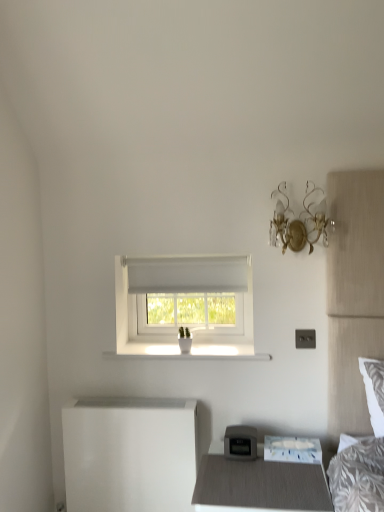
The height and width of the screenshot is (512, 384). Describe the element at coordinates (184, 305) in the screenshot. I see `white fabric window at center` at that location.

What is the approximate width of white fabric window at center?

white fabric window at center is 10.39 inches wide.

What do you see at coordinates (298, 223) in the screenshot? The width and height of the screenshot is (384, 512). I see `gold metallic wall sconce at upper right` at bounding box center [298, 223].

Measure the distance between white glossy changing table at lower left and camera.

6.10 feet.

This screenshot has width=384, height=512. In order to click on white fabric window at center in this screenshot , I will do `click(184, 305)`.

Can you confirm if white glossy changing table at lower left is positioned to the right of matte gray nightstand at lower center?

Incorrect, white glossy changing table at lower left is not on the right side of matte gray nightstand at lower center.

Is point (110, 441) closer to camera compared to point (239, 488)?

No, (110, 441) is behind (239, 488).

How different are the orientations of white glossy changing table at lower left and matte gray nightstand at lower center in degrees?

white glossy changing table at lower left and matte gray nightstand at lower center are facing 3.27 degrees away from each other.

Who is bigger, white glossy changing table at lower left or matte gray nightstand at lower center?

matte gray nightstand at lower center is bigger.

Considering the sizes of objects matte gray nightstand at lower center and white glossy changing table at lower left in the image provided, who is smaller, matte gray nightstand at lower center or white glossy changing table at lower left?

Smaller between the two is white glossy changing table at lower left.

Is matte gray nightstand at lower center shorter than white glossy changing table at lower left?

Yes, matte gray nightstand at lower center is shorter than white glossy changing table at lower left.

How many degrees apart are the facing directions of matte gray nightstand at lower center and white glossy changing table at lower left?

The facing directions of matte gray nightstand at lower center and white glossy changing table at lower left are 3.27 degrees apart.

Is white glossy changing table at lower left at the back of matte gray nightstand at lower center?

No, matte gray nightstand at lower center is not facing away from white glossy changing table at lower left.

Does white glossy changing table at lower left touch gold metallic wall sconce at upper right?

They are not placed beside each other.

Is white glossy changing table at lower left outside of gold metallic wall sconce at upper right?

Yes, white glossy changing table at lower left is outside of gold metallic wall sconce at upper right.

Which is further, (115, 434) or (298, 245)?

The point (115, 434) is farther.

Is white glossy changing table at lower left bigger or smaller than gold metallic wall sconce at upper right?

Considering their sizes, white glossy changing table at lower left takes up more space than gold metallic wall sconce at upper right.

Does white paper at lower right lie in front of white glossy changing table at lower left?

Yes, white paper at lower right is closer to the camera.

Who is bigger, white paper at lower right or white glossy changing table at lower left?

Bigger between the two is white glossy changing table at lower left.

Does point (268, 436) appear closer or farther from the camera than point (74, 450)?

Point (268, 436) appears to be closer to the viewer than point (74, 450).

Based on the photo, would you say white paper at lower right is outside white glossy changing table at lower left?

That's correct, white paper at lower right is outside of white glossy changing table at lower left.

Locate an element on the screen. The image size is (384, 512). light fixture lying in front of the white paper at lower right is located at coordinates (298, 223).

Which is in front, point (292, 438) or point (311, 245)?

Positioned in front is point (311, 245).

From the image's perspective, is white paper at lower right above or below gold metallic wall sconce at upper right?

white paper at lower right is situated lower than gold metallic wall sconce at upper right in the image.

Which object is closer to the camera, white paper at lower right or gold metallic wall sconce at upper right?

gold metallic wall sconce at upper right.

Can we say white fabric window at center lies outside white paper at lower right?

That's correct, white fabric window at center is outside of white paper at lower right.

Is white fabric window at center to the left or to the right of white paper at lower right in the image?

white fabric window at center is positioned on white paper at lower right's left side.

Is white fabric window at center oriented towards white paper at lower right?

No, white fabric window at center is not facing towards white paper at lower right.

From a real-world perspective, is white fabric window at center positioned over white paper at lower right based on gravity?

Indeed, from a real-world perspective, white fabric window at center stands above white paper at lower right.

Which of these two, gold metallic wall sconce at upper right or white glossy changing table at lower left, stands taller?

white glossy changing table at lower left is taller.

From the image's perspective, relative to white glossy changing table at lower left, is gold metallic wall sconce at upper right above or below?

gold metallic wall sconce at upper right is situated higher than white glossy changing table at lower left in the image.

Image resolution: width=384 pixels, height=512 pixels. I want to click on changing table on the left of gold metallic wall sconce at upper right, so click(130, 454).

Looking at their sizes, would you say gold metallic wall sconce at upper right is wider or thinner than white glossy changing table at lower left?

Clearly, gold metallic wall sconce at upper right has more width compared to white glossy changing table at lower left.

Where is `nightstand in front of the white glossy changing table at lower left`? The height and width of the screenshot is (512, 384). nightstand in front of the white glossy changing table at lower left is located at coordinates (261, 485).

Identify the location of nightstand below the white glossy changing table at lower left (from a real-world perspective). (261, 485).

From the picture: Looking at the image, which one is located closer to white smooth window sill at center, white paper at lower right or matte gray nightstand at lower center?

white paper at lower right is positioned closer to the anchor white smooth window sill at center.

Which object lies nearer to the anchor point white glossy changing table at lower left, white smooth window sill at center or gold metallic wall sconce at upper right?

white smooth window sill at center is closer to white glossy changing table at lower left.

Which object lies nearer to the anchor point white smooth window sill at center, white glossy changing table at lower left or white fabric window at center?

white fabric window at center.

Which object lies nearer to the anchor point white glossy changing table at lower left, white smooth window sill at center or white paper at lower right?

white smooth window sill at center is closer to white glossy changing table at lower left.

Which object lies nearer to the anchor point white paper at lower right, matte gray nightstand at lower center or gold metallic wall sconce at upper right?

Based on the image, matte gray nightstand at lower center appears to be nearer to white paper at lower right.

When comparing their distances from white paper at lower right, does matte gray nightstand at lower center or white fabric window at center seem further?

The object further to white paper at lower right is white fabric window at center.

When comparing their distances from white paper at lower right, does white fabric window at center or matte gray nightstand at lower center seem further?

Among the two, white fabric window at center is located further to white paper at lower right.

Considering their positions, is white fabric window at center positioned closer to white glossy changing table at lower left than matte gray nightstand at lower center?

Among the two, matte gray nightstand at lower center is located nearer to white glossy changing table at lower left.

You are a GUI agent. You are given a task and a screenshot of the screen. Output one action in this format:
    pyautogui.click(x=<x>, y=<y>)
    Task: Click on the window sill between gold metallic wall sconce at upper right and white paper at lower right vertically
    The image size is (384, 512).
    Given the screenshot: What is the action you would take?
    pyautogui.click(x=189, y=353)

Where is `window between gold metallic wall sconce at upper right and white smooth window sill at center from top to bottom`? window between gold metallic wall sconce at upper right and white smooth window sill at center from top to bottom is located at coordinates (184, 305).

This screenshot has width=384, height=512. I want to click on window sill that lies between gold metallic wall sconce at upper right and white glossy changing table at lower left from top to bottom, so click(x=189, y=353).

The image size is (384, 512). I want to click on window between gold metallic wall sconce at upper right and white paper at lower right in the vertical direction, so click(x=184, y=305).